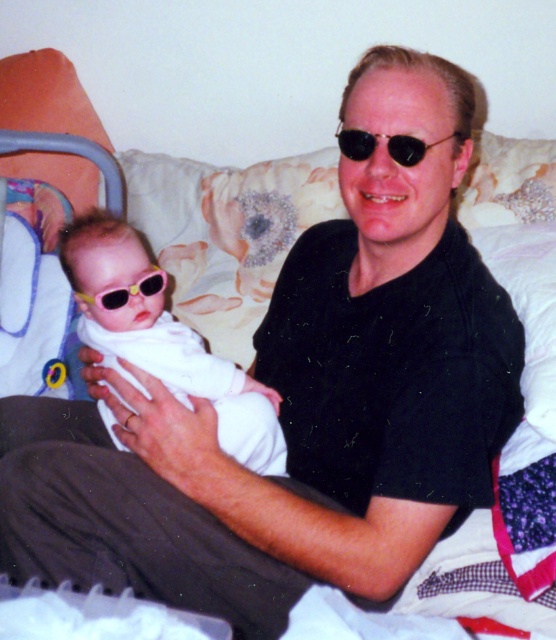
Does white soft baby at center have a greater height compared to yellow plastic goggles at center?

Correct, white soft baby at center is much taller as yellow plastic goggles at center.

Does point (166, 356) come in front of point (136, 284)?

Yes, point (166, 356) is in front of point (136, 284).

This screenshot has height=640, width=556. In order to click on white soft baby at center in this screenshot , I will do `click(162, 337)`.

Does white soft baby at center have a lesser width compared to black matte sunglasses at upper center?

Incorrect, white soft baby at center's width is not less than black matte sunglasses at upper center's.

Looking at this image, can you confirm if white soft baby at center is smaller than black matte sunglasses at upper center?

No, white soft baby at center is not smaller than black matte sunglasses at upper center.

Is point (177, 358) positioned before point (350, 144)?

No, (177, 358) is behind (350, 144).

The width and height of the screenshot is (556, 640). Find the location of `white soft baby at center`. white soft baby at center is located at coordinates (162, 337).

Who is more forward, (461, 134) or (163, 282)?

Point (461, 134)

Is point (395, 145) farther from viewer compared to point (116, 291)?

That is False.

Does point (408, 161) come farther from viewer compared to point (152, 273)?

No, it is not.

Find the location of `black matte sunglasses at upper center`. black matte sunglasses at upper center is located at coordinates (388, 145).